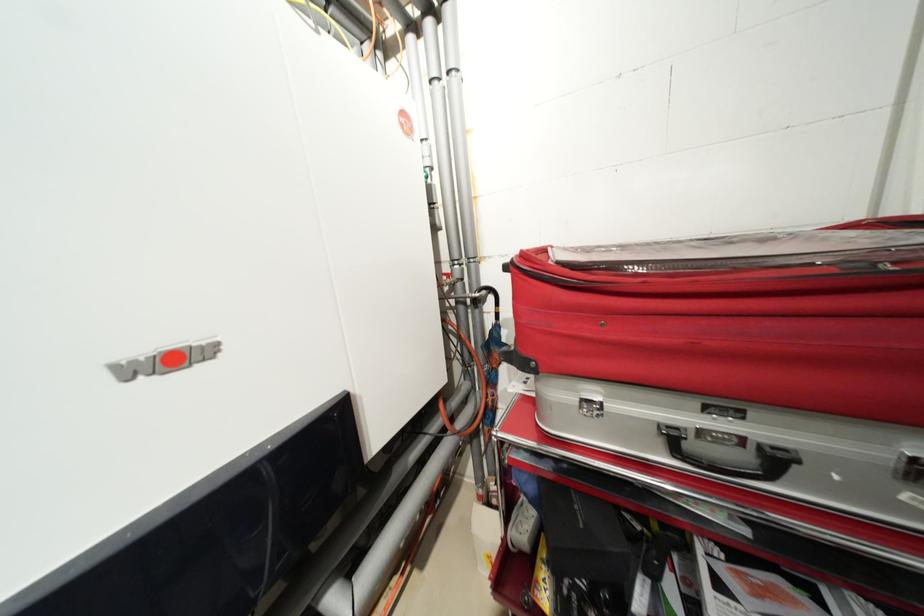
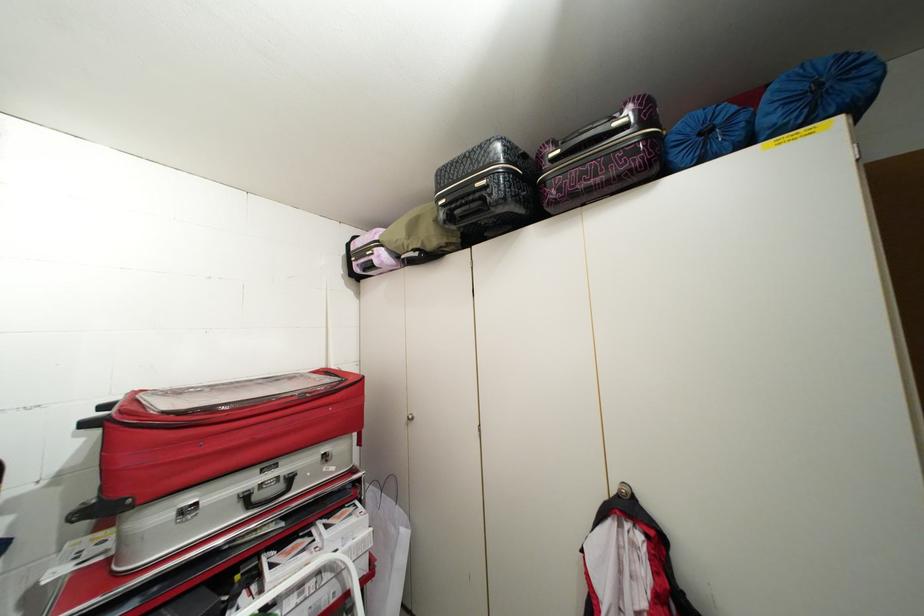
Question: The images are taken continuously from a first-person perspective. In which direction is your viewpoint rotating?

Choices:
 (A) Left
 (B) Right
 (C) Up
 (D) Down

Answer: (B)